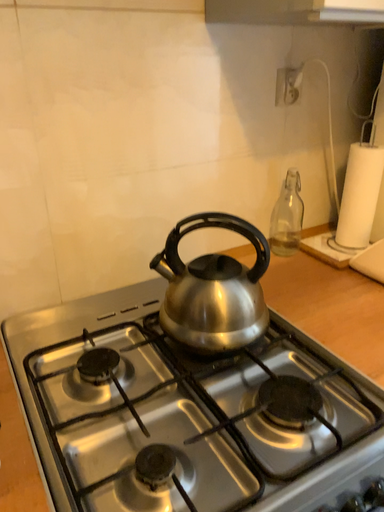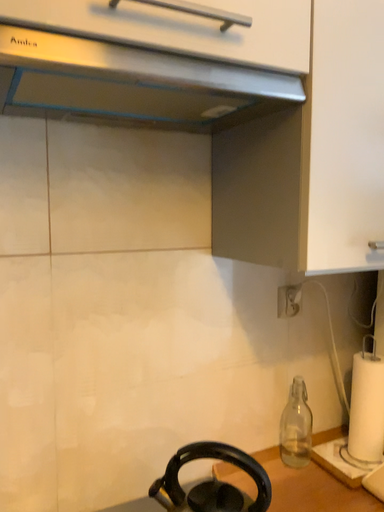
Question: How did the camera likely rotate when shooting the video?

Choices:
 (A) rotated upward
 (B) rotated downward

Answer: (A)